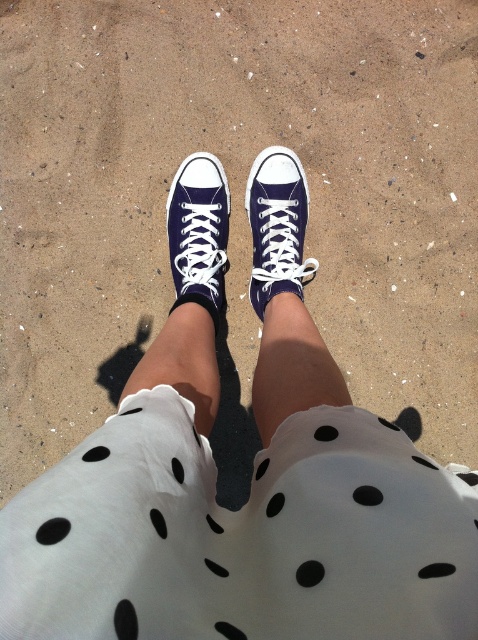
Does matte blue canvas shoe at center appear over matte canvas sneaker at center?

Yes, matte blue canvas shoe at center is above matte canvas sneaker at center.

Describe the element at coordinates (276, 227) in the screenshot. I see `matte blue canvas shoe at center` at that location.

Identify the location of matte blue canvas shoe at center. (276, 227).